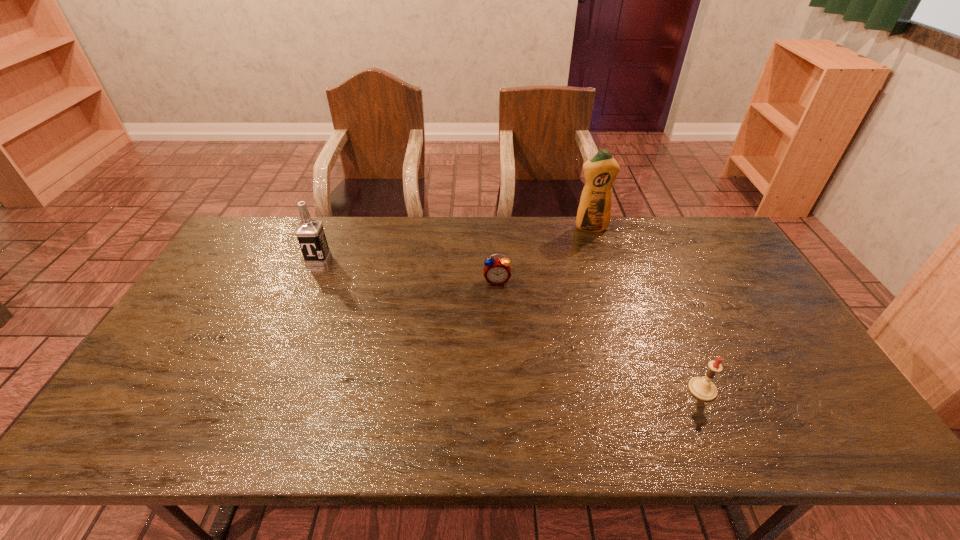
At what (x,y) coordinates should I click in order to perform the action: click on detergent. Please return your answer as a coordinate pair (x, y). Looking at the image, I should click on (594, 212).

Find the location of `the farthest object`. the farthest object is located at coordinates (594, 212).

Identify the location of vodka. (310, 233).

Image resolution: width=960 pixels, height=540 pixels. Find the location of `the second tallest object`. the second tallest object is located at coordinates (310, 233).

Locate an element on the screen. Image resolution: width=960 pixels, height=540 pixels. the nearest object is located at coordinates (702, 388).

Image resolution: width=960 pixels, height=540 pixels. I want to click on the rightmost object, so click(702, 388).

Find the location of a particular element. Image resolution: width=960 pixels, height=540 pixels. alarm clock is located at coordinates (497, 271).

You are a GUI agent. You are given a task and a screenshot of the screen. Output one action in this format:
    pyautogui.click(x=<x>, y=<y>)
    Task: Click on the second nearest object
    
    Given the screenshot: What is the action you would take?
    pyautogui.click(x=497, y=271)

At what (x,y) coordinates should I click in order to perform the action: click on free space located on the label of the third object from left to right. Please return your answer as a coordinate pair (x, y). Looking at the image, I should click on (608, 281).

What are the coordinates of `blank area located 0.280m on the front label of the third shortest object` in the screenshot? It's located at (287, 333).